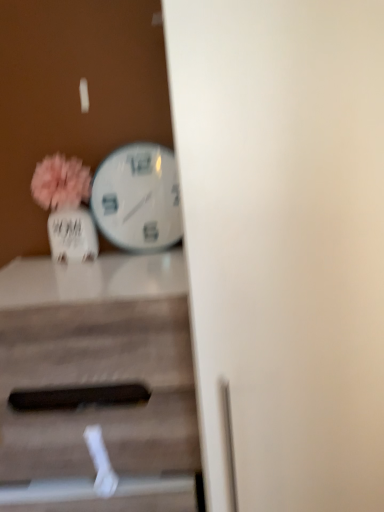
Locate an element on the screen. The height and width of the screenshot is (512, 384). vacant region above wooden table at center (from a real-world perspective) is located at coordinates (86, 273).